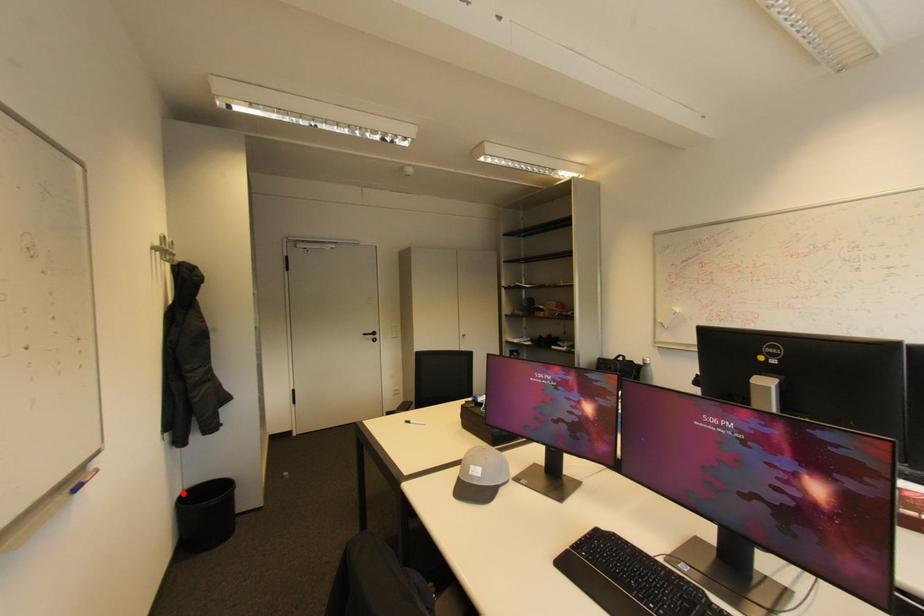
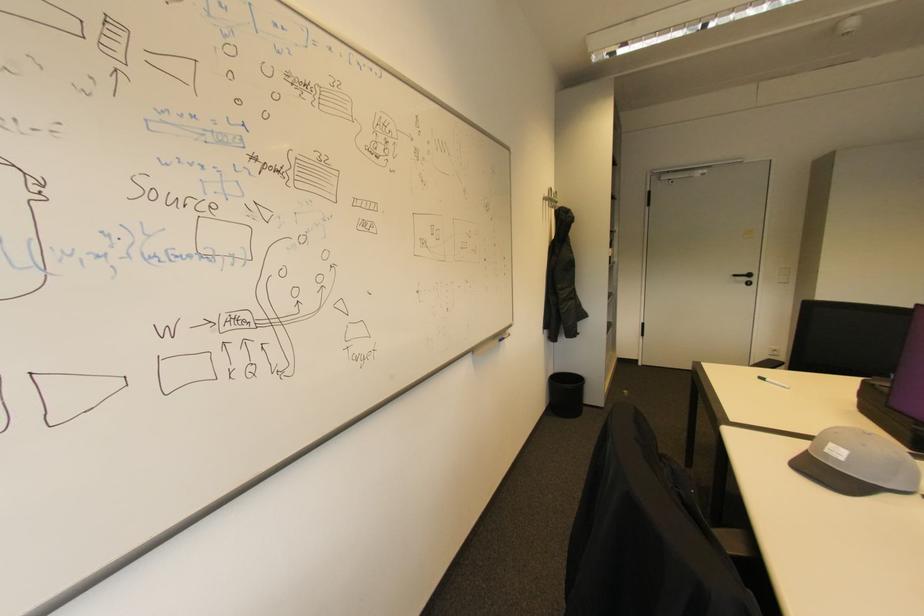
Locate, in the second image, the point that corresponds to the highlighted location in the first image.

(555, 374)